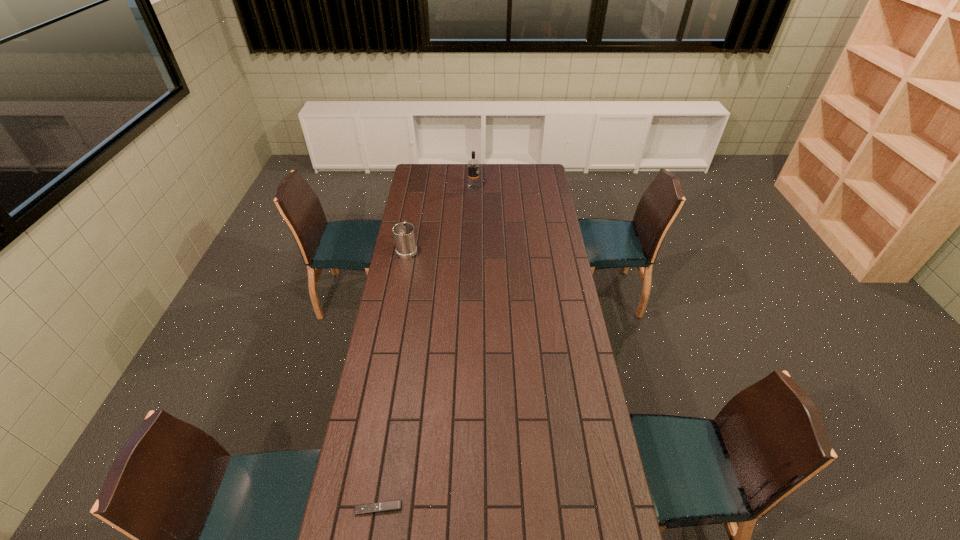
Where is `vodka`? Image resolution: width=960 pixels, height=540 pixels. vodka is located at coordinates (473, 165).

Where is `the rightmost object`? Image resolution: width=960 pixels, height=540 pixels. the rightmost object is located at coordinates (473, 165).

Image resolution: width=960 pixels, height=540 pixels. Identify the location of the second nearest object. (404, 236).

Where is `mug`? This screenshot has height=540, width=960. mug is located at coordinates (404, 236).

Image resolution: width=960 pixels, height=540 pixels. Find the location of `the shortest object`. the shortest object is located at coordinates (387, 506).

Find the location of `the nearest object`. the nearest object is located at coordinates (387, 506).

Identify the location of vacant space situated on the label of the farthest object. The image size is (960, 540). (492, 188).

I want to click on free location located 0.240m on the side of the mug with the handle, so click(x=414, y=212).

Where is `vacant region located on the side of the mug with the handle`? vacant region located on the side of the mug with the handle is located at coordinates (416, 201).

At what (x,y) coordinates should I click in order to perform the action: click on vacant space located 0.380m on the side of the mug with the handle. Please return your answer as a coordinate pair (x, y). Looking at the image, I should click on (x=417, y=198).